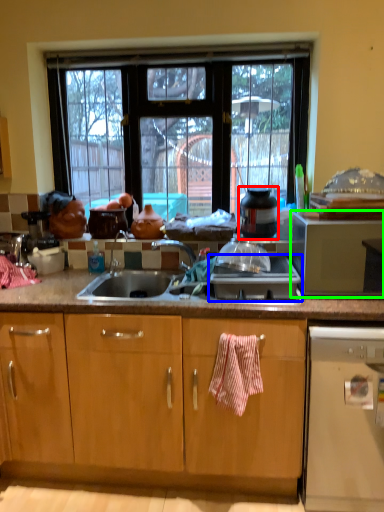
Question: Which object is positioned closest to appliance (highlighted by a red box)? Select from gas stove (highlighted by a blue box) and microwave oven (highlighted by a green box).

Choices:
 (A) gas stove
 (B) microwave oven

Answer: (A)